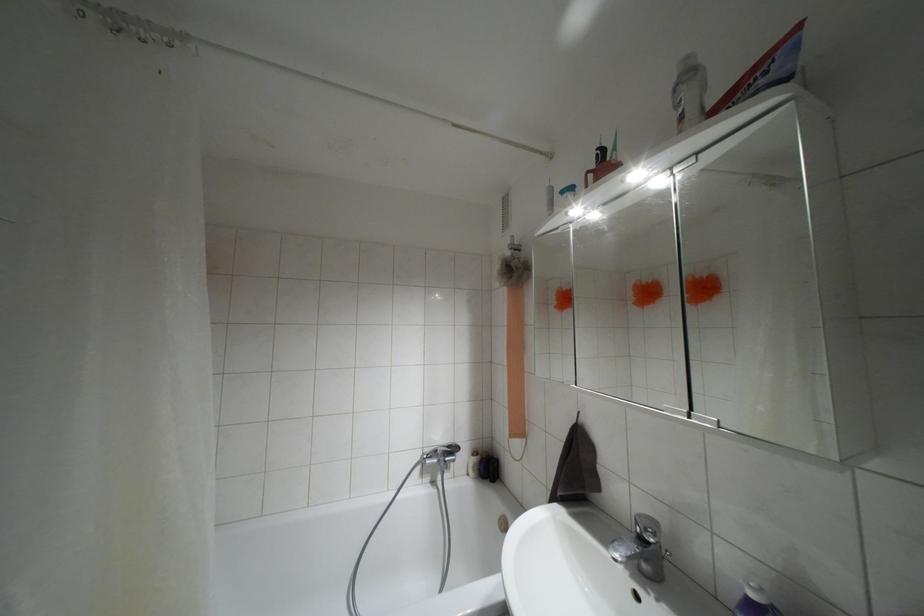
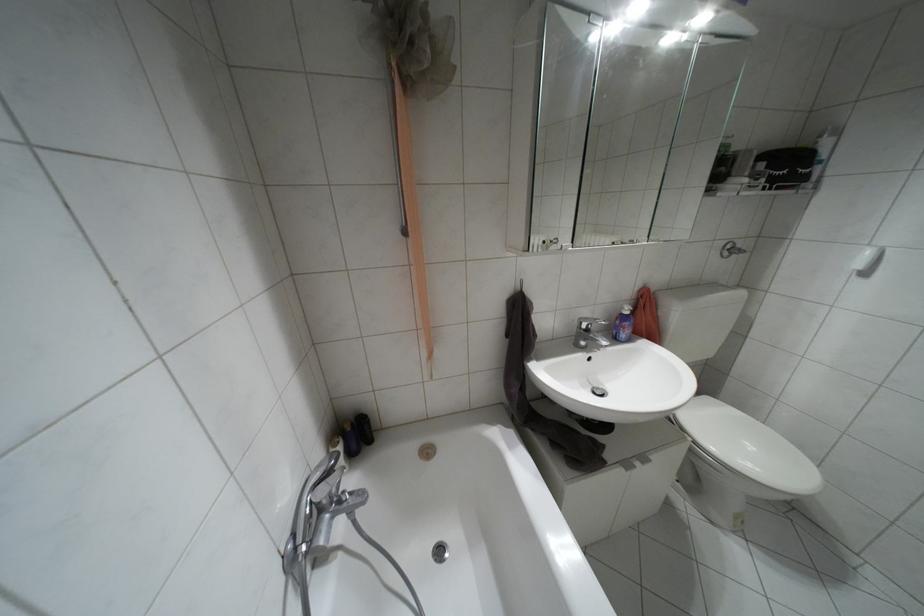
Find the pixel in the second image that matches point (641, 538) in the first image.

(587, 330)